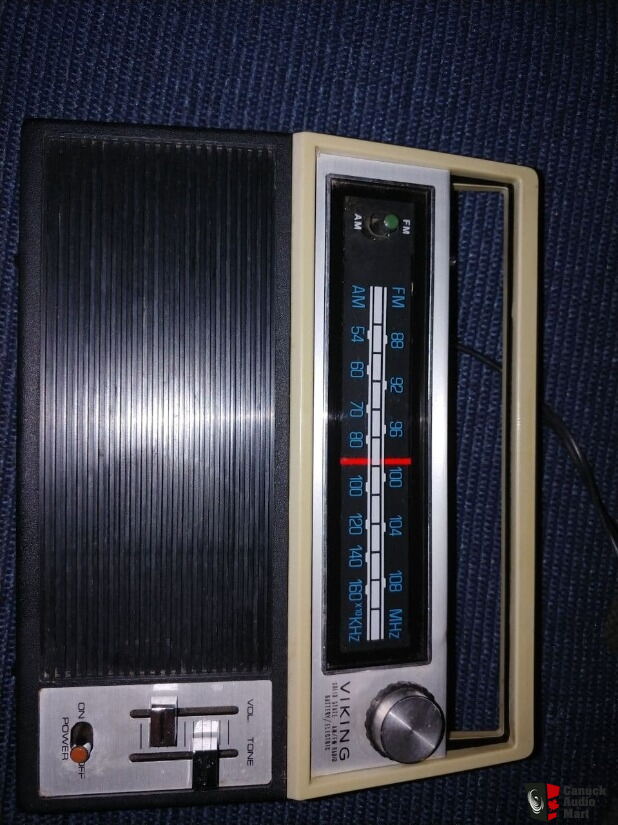
This screenshot has width=618, height=825. I want to click on black electrical cable, so click(575, 450).